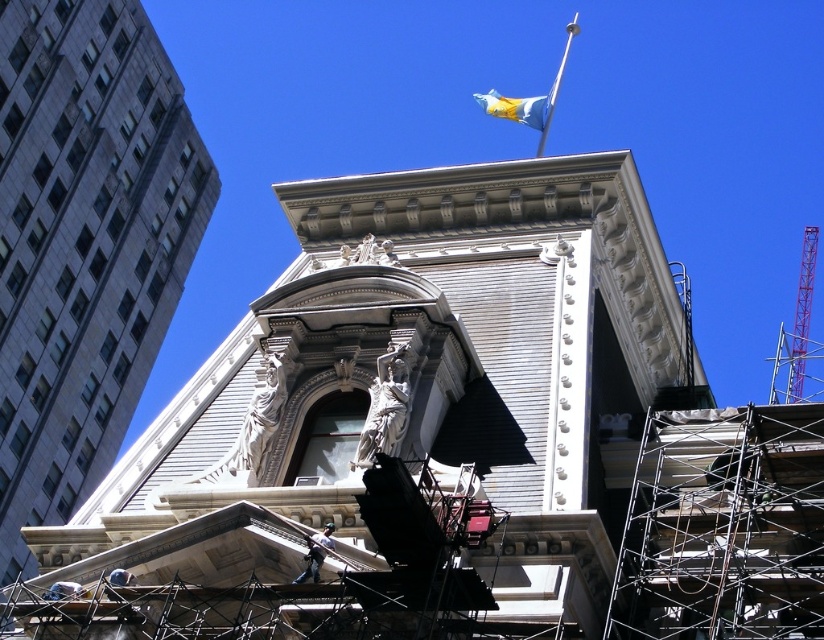
Question: Which of the following is the closest to the observer?

Choices:
 (A) (539, 138)
 (B) (316, 536)
 (C) (550, 109)

Answer: (B)

Question: Can you confirm if smooth gray stone tower at center is positioned to the right of metallic helmet at lower center?

Choices:
 (A) no
 (B) yes

Answer: (B)

Question: Which of these objects is positioned farthest from the metallic helmet at lower center?

Choices:
 (A) silver metallic flag pole at upper center
 (B) gray stone building at upper left
 (C) blue fabric flag at upper center

Answer: (B)

Question: Which point appears closest to the camera in this image?

Choices:
 (A) (578, 26)
 (B) (534, 109)
 (C) (331, 412)
 (D) (169, 211)

Answer: (C)

Question: Is smooth gray stone tower at center wider than metallic helmet at lower center?

Choices:
 (A) no
 (B) yes

Answer: (B)

Question: From the image, what is the correct spatial relationship of smooth gray stone tower at center in relation to metallic helmet at lower center?

Choices:
 (A) right
 (B) left

Answer: (A)